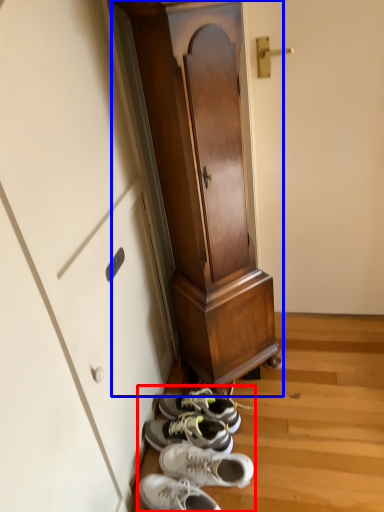
Question: Which object is further to the camera taking this photo, shoe (highlighted by a red box) or furniture (highlighted by a blue box)?

Choices:
 (A) shoe
 (B) furniture

Answer: (A)